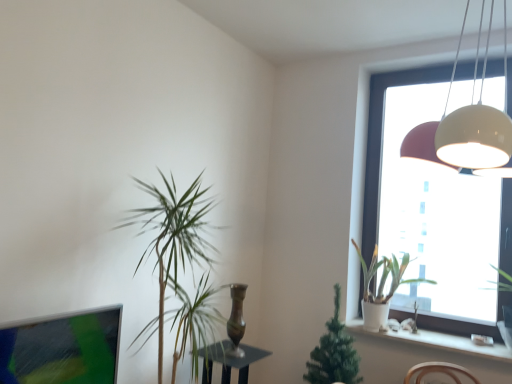
Question: Would you say white matte pot at window, arranged as the second houseplant when viewed from the left, is outside green leafy plant at window, positioned as the third houseplant in left-to-right order?

Choices:
 (A) yes
 (B) no

Answer: (A)

Question: Is white matte pot at window, arranged as the second houseplant when viewed from the left, positioned far away from green leafy plant at window, positioned as the third houseplant in left-to-right order?

Choices:
 (A) yes
 (B) no

Answer: (B)

Question: Can you see white matte pot at window, arranged as the second houseplant when viewed from the left, touching green leafy plant at window, positioned as the third houseplant in left-to-right order?

Choices:
 (A) no
 (B) yes

Answer: (A)

Question: Is white matte pot at window, which is counted as the 2th houseplant, starting from the right, facing towards green leafy plant at window, positioned as the third houseplant in left-to-right order?

Choices:
 (A) yes
 (B) no

Answer: (B)

Question: Is green leafy plant at window, which is the first houseplant from right to left, inside white matte pot at window, which is counted as the 2th houseplant, starting from the right?

Choices:
 (A) no
 (B) yes

Answer: (A)

Question: Which is correct: white matte pot at window, which is counted as the 2th houseplant, starting from the right, is inside bronze metallic vase at center, or outside of it?

Choices:
 (A) inside
 (B) outside

Answer: (B)

Question: Does point (356, 251) appear closer or farther from the camera than point (244, 331)?

Choices:
 (A) closer
 (B) farther

Answer: (A)

Question: In terms of height, does white matte pot at window, which is counted as the 2th houseplant, starting from the right, look taller or shorter compared to bronze metallic vase at center?

Choices:
 (A) tall
 (B) short

Answer: (A)

Question: From a real-world perspective, is white matte pot at window, arranged as the second houseplant when viewed from the left, positioned above or below bronze metallic vase at center?

Choices:
 (A) above
 (B) below

Answer: (A)

Question: Does point (504, 344) appear closer or farther from the camera than point (372, 144)?

Choices:
 (A) farther
 (B) closer

Answer: (B)

Question: From the image's perspective, is green leafy plant at window, positioned as the third houseplant in left-to-right order, located above or below white glossy window at upper right?

Choices:
 (A) above
 (B) below

Answer: (B)

Question: In the image, is green leafy plant at window, positioned as the third houseplant in left-to-right order, positioned in front of or behind white glossy window at upper right?

Choices:
 (A) front
 (B) behind

Answer: (A)

Question: Is green leafy plant at window, positioned as the third houseplant in left-to-right order, to the left or to the right of white glossy window at upper right in the image?

Choices:
 (A) left
 (B) right

Answer: (B)

Question: In the image, is green leafy plant at window, which is the first houseplant from right to left, positioned in front of or behind white matte pot at window, which is counted as the 2th houseplant, starting from the right?

Choices:
 (A) behind
 (B) front

Answer: (B)

Question: From a real-world perspective, is green leafy plant at window, positioned as the third houseplant in left-to-right order, physically located above or below white matte pot at window, which is counted as the 2th houseplant, starting from the right?

Choices:
 (A) below
 (B) above

Answer: (B)